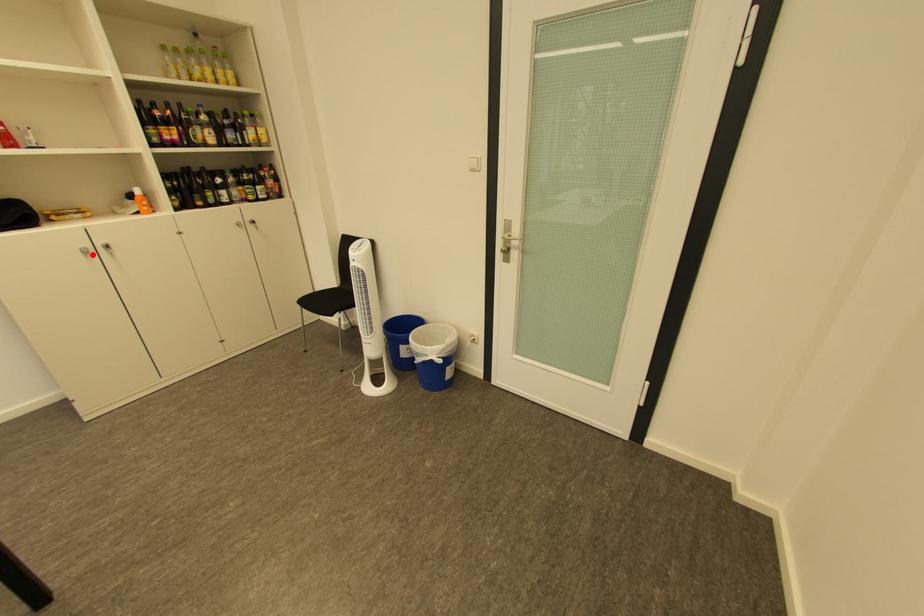
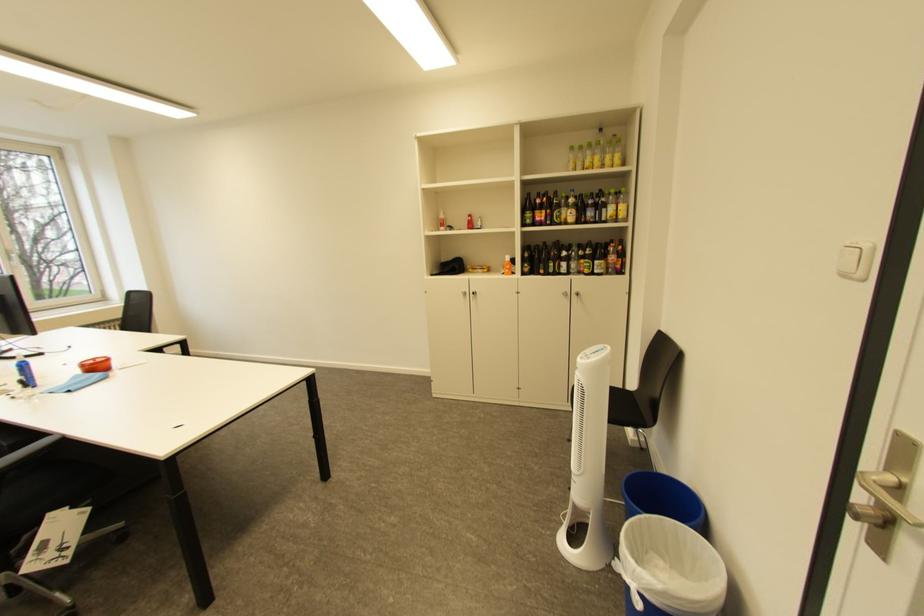
In the second image, find the point that corresponds to the highlighted location in the first image.

(472, 296)